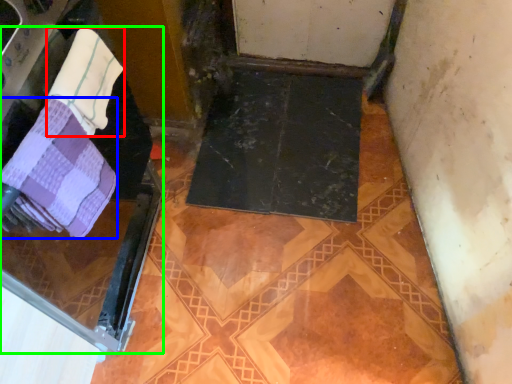
Question: Which is farther away from towel (highlighted by a red box)? towel (highlighted by a blue box) or screen door (highlighted by a green box)?

Choices:
 (A) towel
 (B) screen door

Answer: (B)